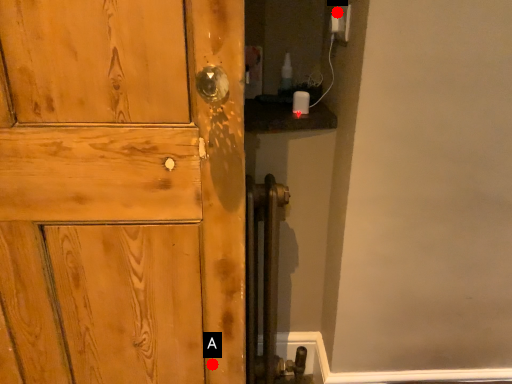
Question: Two points are circled on the image, labeled by A and B beside each circle. Which point appears closest to the camera in this image?

Choices:
 (A) A is closer
 (B) B is closer

Answer: (A)